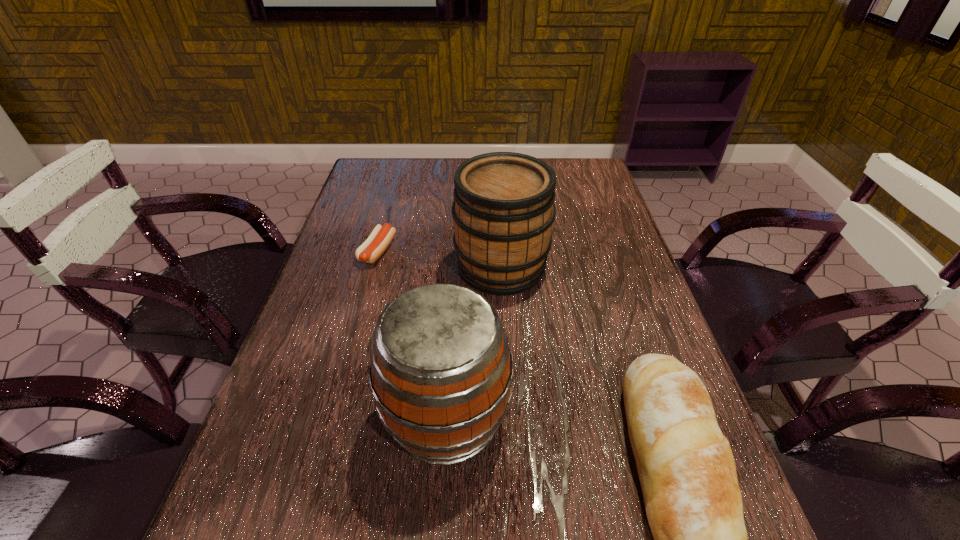
Locate an element on the screen. The height and width of the screenshot is (540, 960). vacant position at the far left corner of the desktop is located at coordinates (380, 193).

Find the location of `free spot at the far right corner of the desktop`. free spot at the far right corner of the desktop is located at coordinates (571, 176).

Where is `free space between the farther cider and the sausage`? Image resolution: width=960 pixels, height=540 pixels. free space between the farther cider and the sausage is located at coordinates (440, 259).

At what (x,y) coordinates should I click in order to perform the action: click on vacant area that lies between the leftmost object and the farther cider. Please return your answer as a coordinate pair (x, y). Image resolution: width=960 pixels, height=540 pixels. Looking at the image, I should click on (440, 259).

Identify the location of free space that is in between the sausage and the farther cider. (x=440, y=259).

What are the coordinates of `the third closest object to the second shortest object` in the screenshot? It's located at (380, 238).

Point out which object is positioned as the second nearest to the nearer cider. Please provide its 2D coordinates. Your answer should be formatted as a tuple, i.e. [(x, y)], where the tuple contains the x and y coordinates of a point satisfying the conditions above.

[(693, 503)]

Find the location of a particular element. vacant space that satisfies the following two spatial constraints: 1. on the back side of the nearer cider; 2. on the right side of the farther cider is located at coordinates (456, 266).